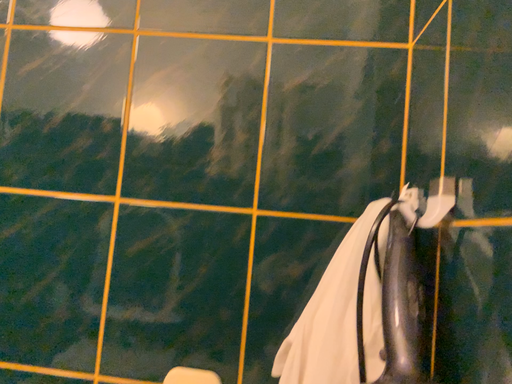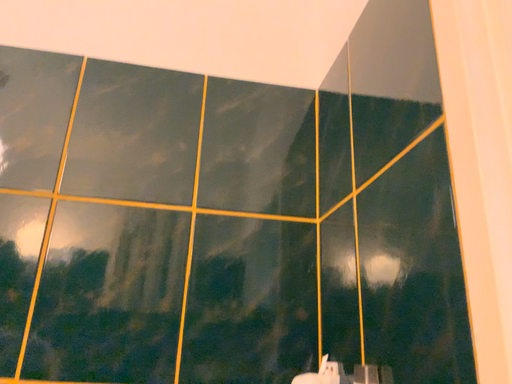
Question: Which way did the camera rotate in the video?

Choices:
 (A) rotated left
 (B) rotated right

Answer: (B)